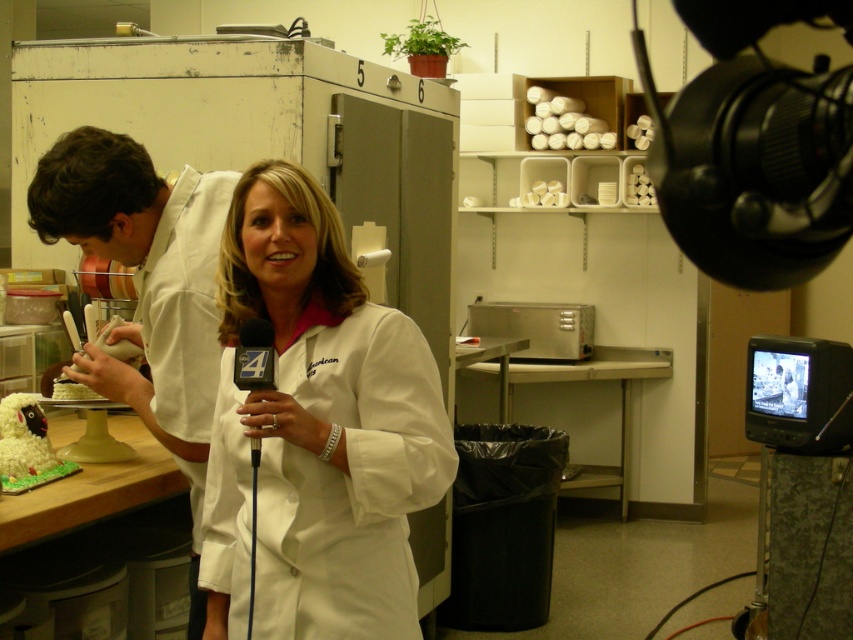
Question: Does white matte chef coat at left come in front of black plastic microphone at center?

Choices:
 (A) no
 (B) yes

Answer: (A)

Question: Is white lab coat at center below white matte chef coat at left?

Choices:
 (A) no
 (B) yes

Answer: (B)

Question: Which object appears closest to the camera in this image?

Choices:
 (A) black plastic video camera at upper right
 (B) white matte chef coat at left

Answer: (A)

Question: Is white matte chef coat at left to the right of black plastic microphone at center from the viewer's perspective?

Choices:
 (A) no
 (B) yes

Answer: (A)

Question: Estimate the real-world distances between objects in this image. Which object is farther from the white lab coat at center?

Choices:
 (A) black plastic video camera at upper right
 (B) black plastic microphone at center
 (C) white matte chef coat at left

Answer: (A)

Question: Which object is farther from the camera taking this photo?

Choices:
 (A) white matte chef coat at left
 (B) white lab coat at center
 (C) black plastic microphone at center

Answer: (A)